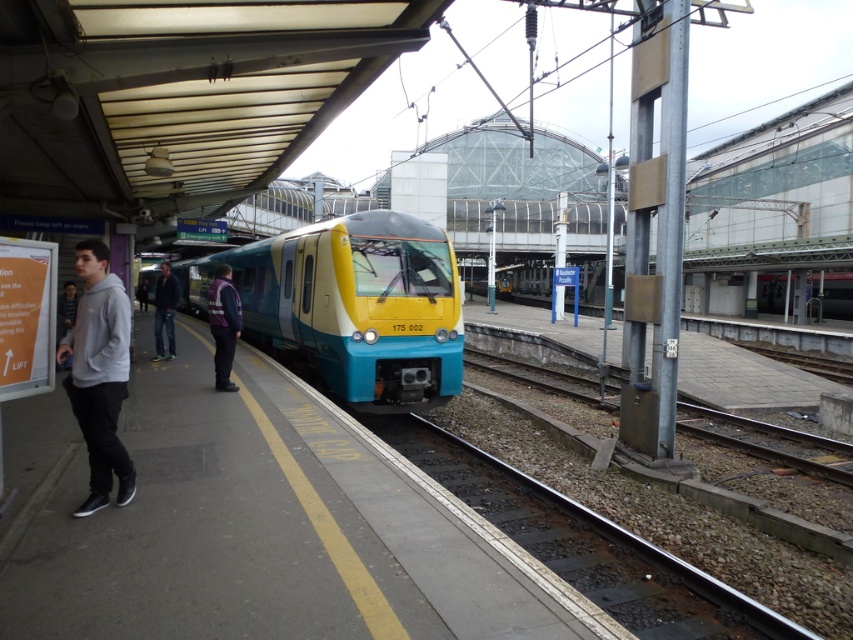
You are a pedestrian standing on the platform and want to walk from the smooth metal train track at center to the reflective purple jacket at center. Which path should you take to avoid the tracks?

The smooth metal train track at center has a lesser width compared to reflective purple jacket at center, so you should walk towards the reflective purple jacket at center as it occupies a wider area, making it safer to avoid the tracks.

You are a passenger waiting for the train at the station. You see the gray fleece at left and the reflective purple jacket at center. Which clothing item is closer to the train tracks?

The gray fleece at left is closer to the train tracks because it is shorter than the reflective purple jacket at center, meaning it is positioned in front of the taller jacket.